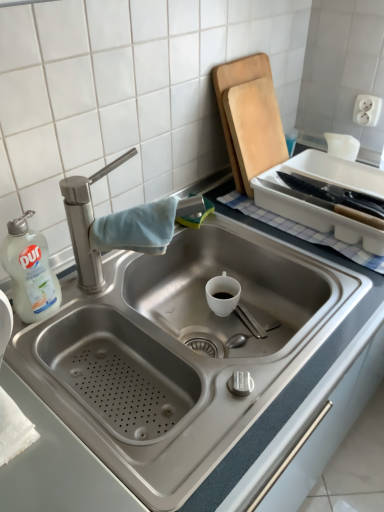
Question: Is point (350, 178) positioned closer to the camera than point (26, 322)?

Choices:
 (A) closer
 (B) farther

Answer: (B)

Question: In terms of height, does white plastic tray at upper right look taller or shorter compared to white plastic bottle at left?

Choices:
 (A) short
 (B) tall

Answer: (A)

Question: Which object is the closest to the white plastic bottle at left?

Choices:
 (A) white plastic tray at upper right
 (B) wooden cutting board at upper right
 (C) stainless steel sink at center

Answer: (C)

Question: Which of these objects is positioned closest to the stainless steel sink at center?

Choices:
 (A) wooden cutting board at upper right
 (B) white plastic tray at upper right
 (C) white plastic bottle at left

Answer: (C)